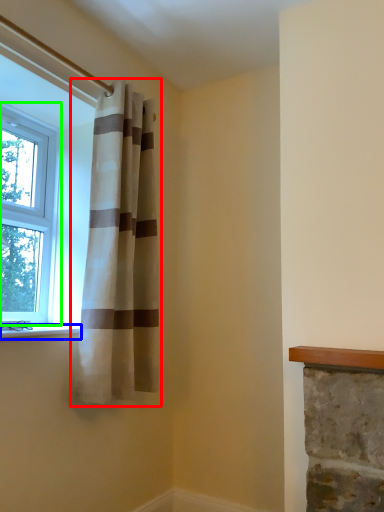
Question: Which is farther away from curtain (highlighted by a red box)? window sill (highlighted by a blue box) or window (highlighted by a green box)?

Choices:
 (A) window sill
 (B) window

Answer: (A)